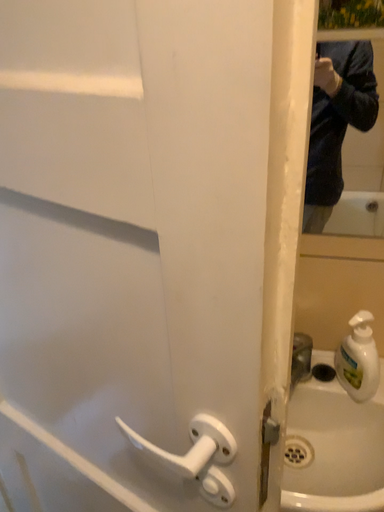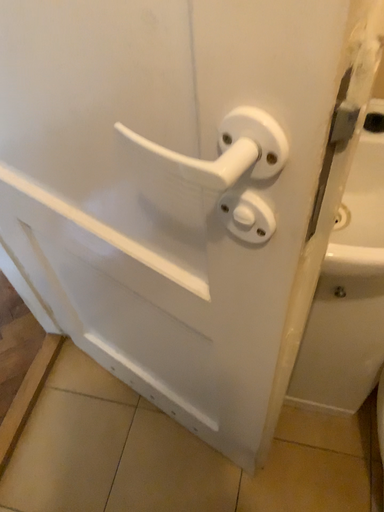
Question: Which way did the camera rotate in the video?

Choices:
 (A) rotated upward
 (B) rotated downward

Answer: (B)